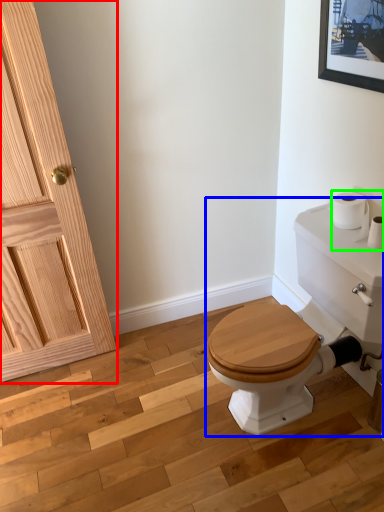
Question: Which object is the farthest from door (highlighted by a red box)? Choose among these: porcelain (highlighted by a blue box) or toilet paper (highlighted by a green box).

Choices:
 (A) porcelain
 (B) toilet paper

Answer: (B)